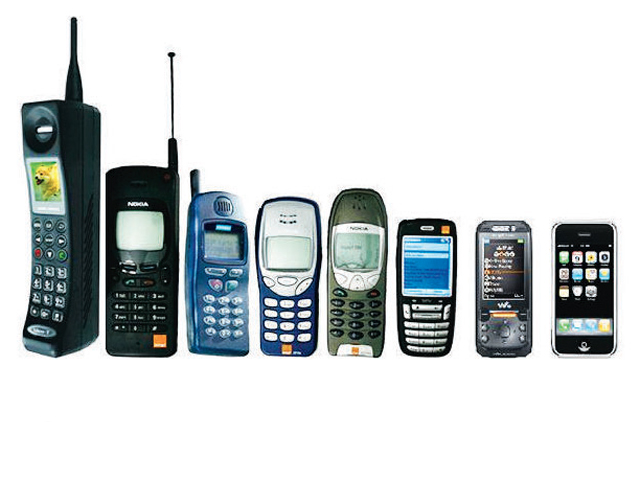
Locate an element on the screen. The width and height of the screenshot is (640, 480). phone screen is located at coordinates (38, 178), (132, 231), (218, 239), (282, 255), (353, 244), (424, 268), (499, 271), (582, 276).